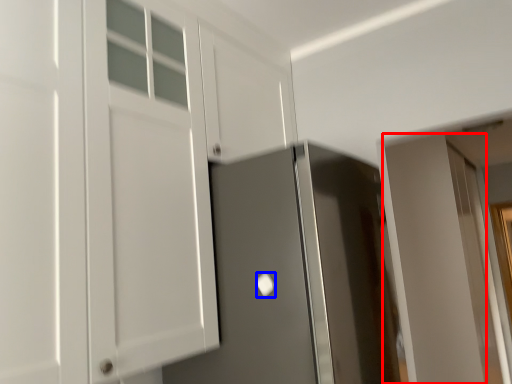
Question: Which of the following is the closest to the observer, door (highlighted by a red box) or door handle (highlighted by a blue box)?

Choices:
 (A) door
 (B) door handle

Answer: (B)